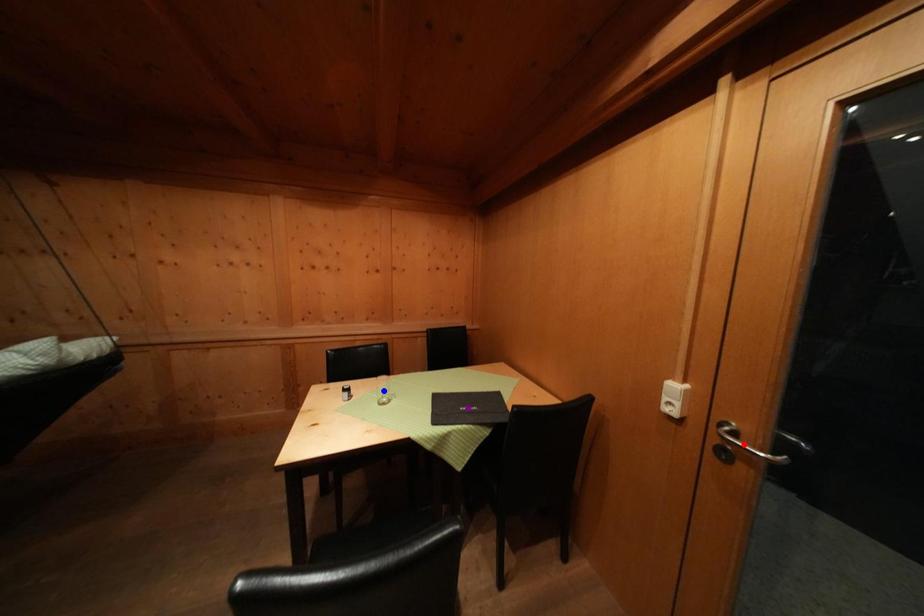
Order these from nearest to farthest:
blue point | red point | purple point

red point
blue point
purple point